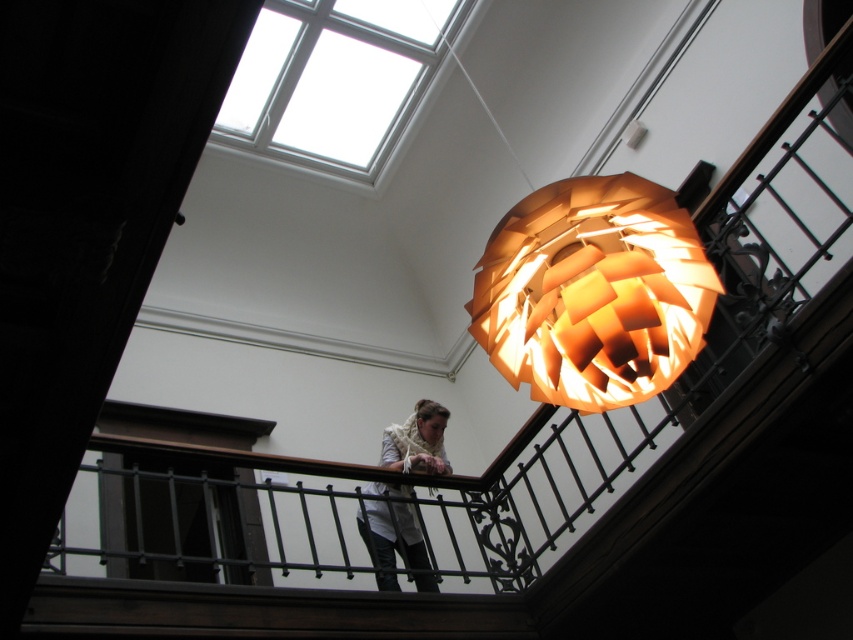
You are standing on the balcony and want to hang a small decoration from the matte orange paper lampshade at upper center. Can you reach it while standing on the white fabric at center?

The matte orange paper lampshade at upper center is located above the white fabric at center, so it may be out of reach unless you have a ladder or some means to elevate yourself.

Consider the image. You are an interior designer assessing the space. You notice the matte orange paper lampshade at upper center and the white fabric at center. Which object is closer to the ceiling?

The matte orange paper lampshade at upper center is closer to the ceiling because it is shorter than the white fabric at center.

You are an interior designer planning to install a new wall sconce. The existing matte orange paper lampshade at upper center is located at coordinates point 0.458, 0.696. If the new sconce must be placed at least 0.3 meters away from any existing fixtures, where should you position it?

The new wall sconce should be positioned more than 0.3 meters away from the matte orange paper lampshade at upper center, which is currently at point (593,292). Ensure the distance between the two fixtures meets the required spacing.